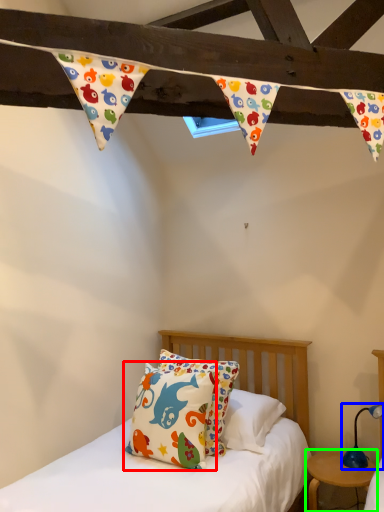
Question: Considering the real-world distances, which object is closest to pillow (highlighted by a red box)? table lamp (highlighted by a blue box) or nightstand (highlighted by a green box).

Choices:
 (A) table lamp
 (B) nightstand

Answer: (B)